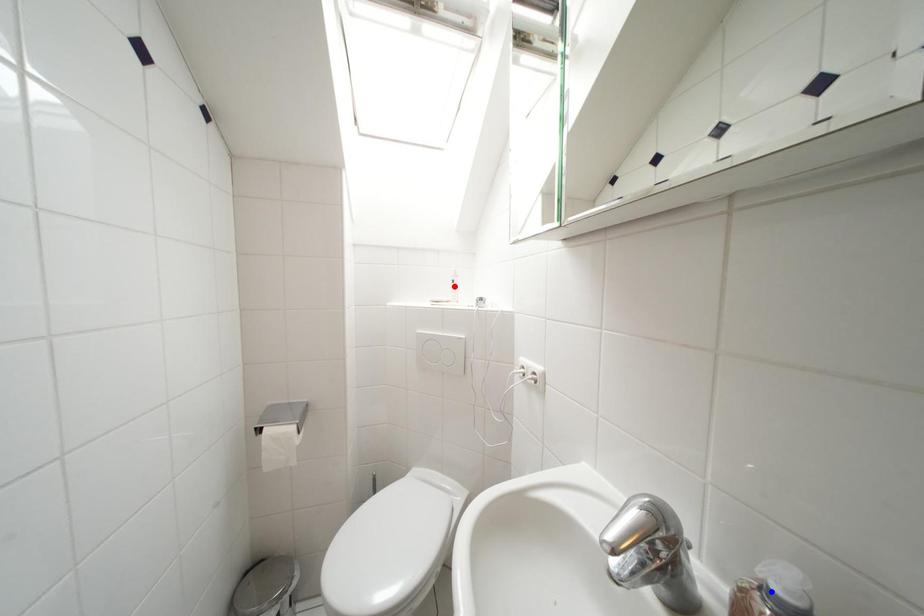
Question: In the image, two points are highlighted. Which point is nearer to the camera? Reply with the corresponding letter.

Choices:
 (A) blue point
 (B) red point

Answer: (A)